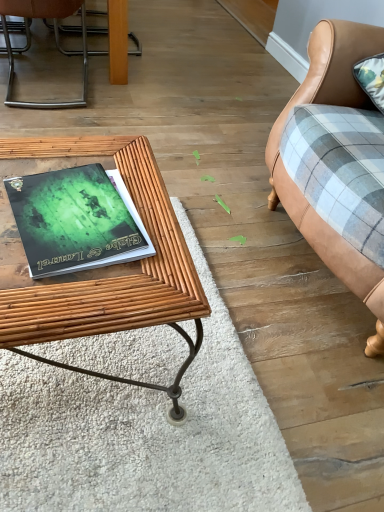
Question: Visually, is leather couch at right positioned to the left or to the right of bambooobject at left?

Choices:
 (A) right
 (B) left

Answer: (A)

Question: Considering the positions of leather couch at right and bambooobject at left in the image, is leather couch at right taller or shorter than bambooobject at left?

Choices:
 (A) short
 (B) tall

Answer: (B)

Question: Based on their relative distances, which object is nearer to the green matte book at center?

Choices:
 (A) leather couch at right
 (B) bambooobject at left
 (C) metallic silver chair at upper left
 (D) green matte book at center

Answer: (B)

Question: Estimate the real-world distances between objects in this image. Which object is closer to the green matte book at center?

Choices:
 (A) metallic silver chair at upper left
 (B) green matte book at center
 (C) bambooobject at left
 (D) leather couch at right

Answer: (C)